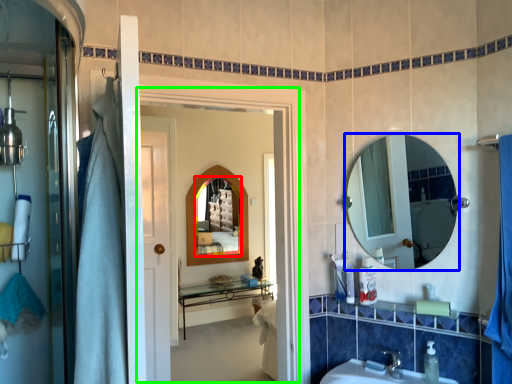
Question: Which object is the farthest from mirror (highlighted by a red box)? Choose among these: mirror (highlighted by a blue box) or screen door (highlighted by a green box).

Choices:
 (A) mirror
 (B) screen door

Answer: (B)